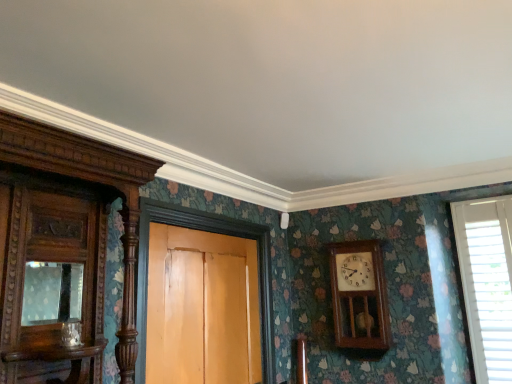
Question: Is wooden wall clock at center-right closer to camera compared to wooden door at center?

Choices:
 (A) yes
 (B) no

Answer: (B)

Question: Is wooden wall clock at center-right at the right side of wooden door at center?

Choices:
 (A) yes
 (B) no

Answer: (A)

Question: Does wooden wall clock at center-right come behind wooden door at center?

Choices:
 (A) yes
 (B) no

Answer: (A)

Question: Considering the relative sizes of wooden wall clock at center-right and wooden door at center in the image provided, is wooden wall clock at center-right bigger than wooden door at center?

Choices:
 (A) no
 (B) yes

Answer: (A)

Question: Does wooden wall clock at center-right have a lesser width compared to wooden door at center?

Choices:
 (A) yes
 (B) no

Answer: (B)

Question: From a real-world perspective, is wooden wall clock at center-right on top of wooden door at center?

Choices:
 (A) no
 (B) yes

Answer: (B)

Question: Is wooden door at center thinner than white plastic blinds at right?

Choices:
 (A) no
 (B) yes

Answer: (A)

Question: From the image's perspective, is wooden door at center beneath white plastic blinds at right?

Choices:
 (A) no
 (B) yes

Answer: (B)

Question: Can you confirm if wooden door at center is wider than white plastic blinds at right?

Choices:
 (A) yes
 (B) no

Answer: (A)

Question: Does wooden door at center turn towards white plastic blinds at right?

Choices:
 (A) no
 (B) yes

Answer: (A)

Question: From a real-world perspective, is wooden door at center over white plastic blinds at right?

Choices:
 (A) no
 (B) yes

Answer: (A)

Question: From a real-world perspective, is wooden door at center beneath white plastic blinds at right?

Choices:
 (A) yes
 (B) no

Answer: (A)

Question: Are wooden wall clock at center-right and matte glass mirror at left located far from each other?

Choices:
 (A) yes
 (B) no

Answer: (A)